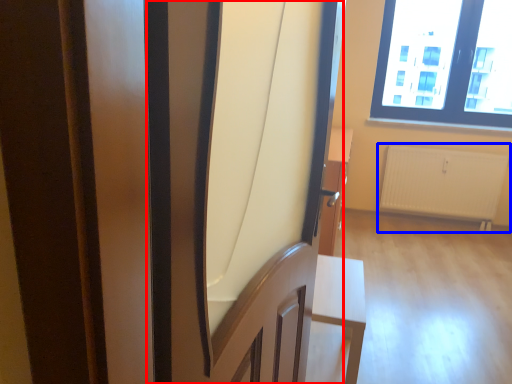
Question: Which object is closer to the camera taking this photo, screen door (highlighted by a red box) or radiator (highlighted by a blue box)?

Choices:
 (A) screen door
 (B) radiator

Answer: (A)